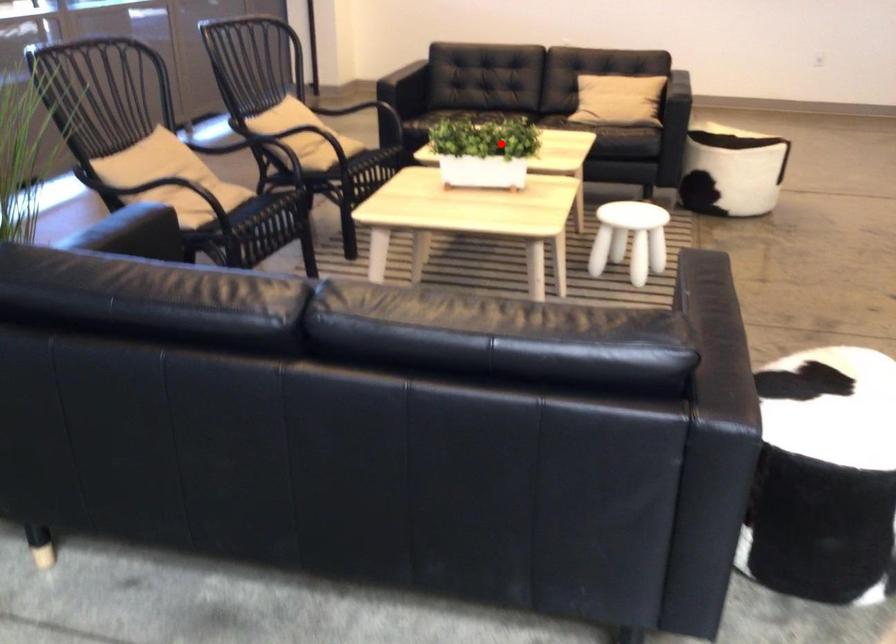
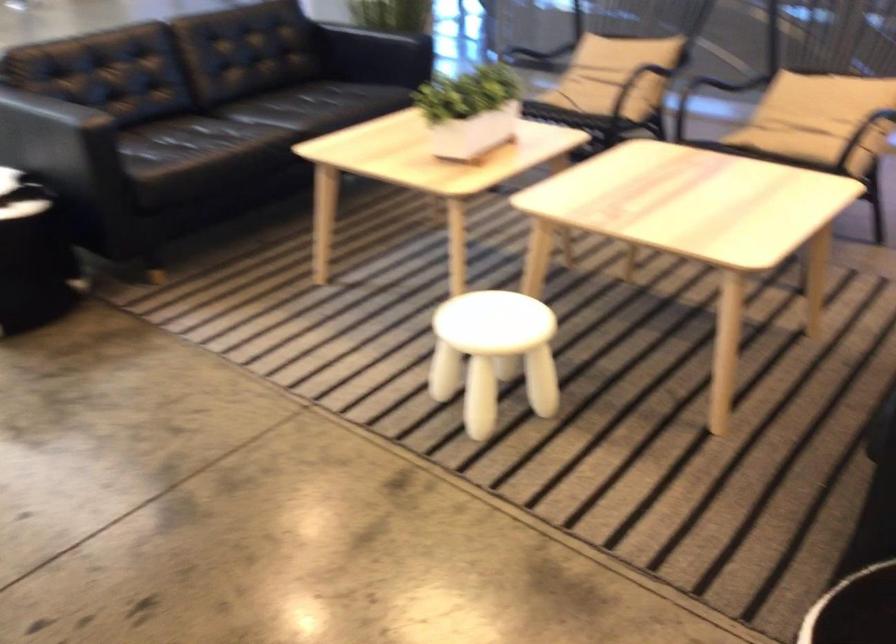
Question: I am providing you with two images of the same scene from different viewpoints. In image1, a red point is highlighted. Considering the same 3D point in image2, which of the following is correct?

Choices:
 (A) It is closer
 (B) It is farther

Answer: (A)